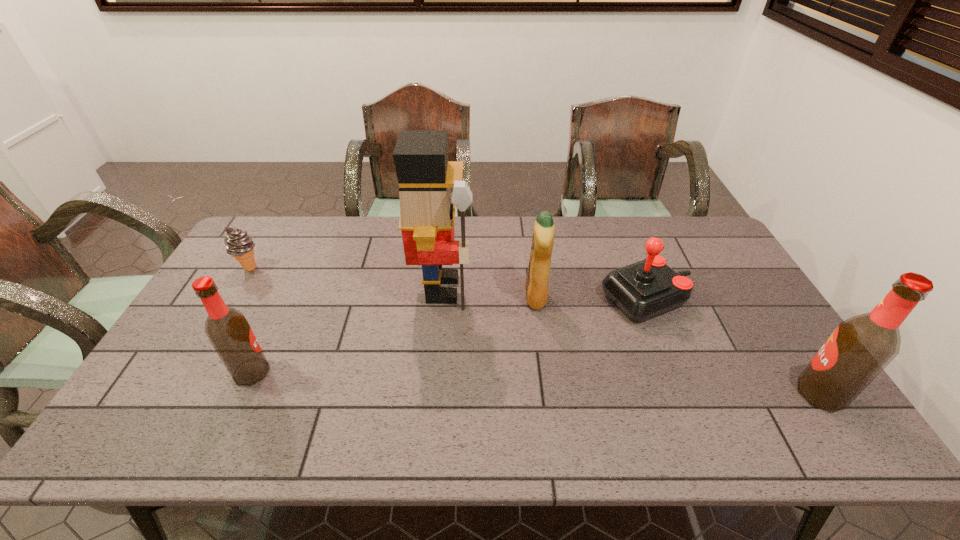
I want to click on object located at the right edge, so click(x=860, y=348).

Identify the location of object that is at the near right corner. This screenshot has width=960, height=540. (860, 348).

This screenshot has width=960, height=540. I want to click on vacant space at the far edge of the desktop, so pos(500,232).

You are a GUI agent. You are given a task and a screenshot of the screen. Output one action in this format:
    pyautogui.click(x=<x>, y=<y>)
    Task: Click on the vacant region at the near edge of the desktop
    The image size is (960, 540).
    Given the screenshot: What is the action you would take?
    pyautogui.click(x=543, y=387)

Find the location of a particular element. This screenshot has height=540, width=960. vacant space at the right edge is located at coordinates (758, 350).

Locate an element on the screen. The width and height of the screenshot is (960, 540). blank area at the far left corner is located at coordinates (261, 223).

Image resolution: width=960 pixels, height=540 pixels. I want to click on free space at the far right corner of the desktop, so click(x=716, y=256).

Identify the location of vacant space at the near right corner of the desktop. (795, 392).

At what (x,y) coordinates should I click in order to perform the action: click on vacant area that lies between the left beer bottle and the fifth shortest object. Please return your answer as a coordinate pair (x, y). This screenshot has width=960, height=540. Looking at the image, I should click on (536, 383).

Identify the location of unoccupied position between the third object from right to left and the left beer bottle. The width and height of the screenshot is (960, 540). (394, 335).